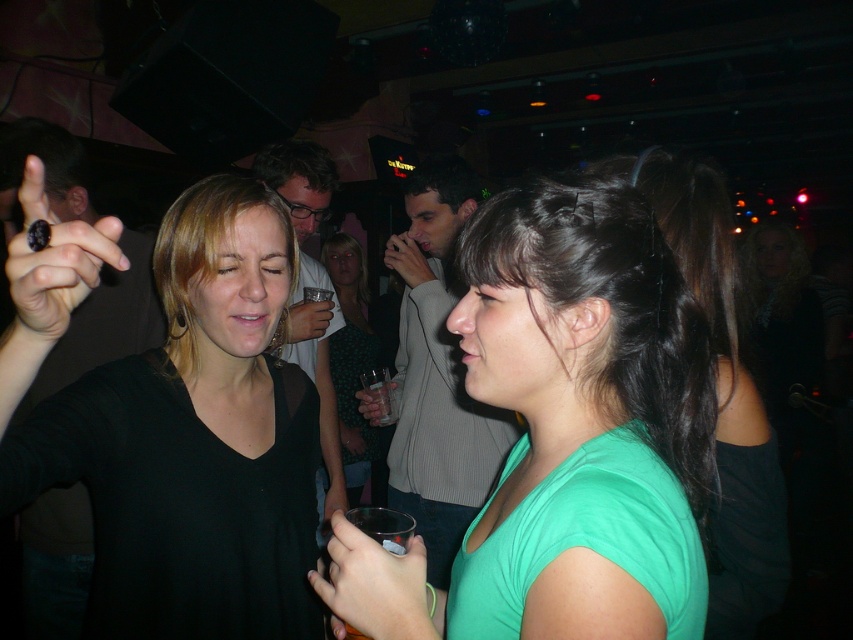
You are a bartender preparing to serve a drink. You see the green matte shirt at center and the translucent plastic cup at lower center. Which object is bigger in size?

The green matte shirt at center is larger in size than the translucent plastic cup at lower center.

In the nightclub scene, you notice two people wearing different clothing items. The black matte shirt at upper left and the gray sweater at center. Which clothing item is positioned more to the left side of the image?

The black matte shirt at upper left is positioned more to the left side of the image as it is to the left of the gray sweater at center.

You are a photographer at the nightclub and need to decide which clothing item to focus on for a closeup shot. Since the black matte shirt at upper left is smaller than the gray sweater at center, which one would you choose to ensure the subject fills the frame better?

The gray sweater at center is larger, so focusing on it would fill the frame better.